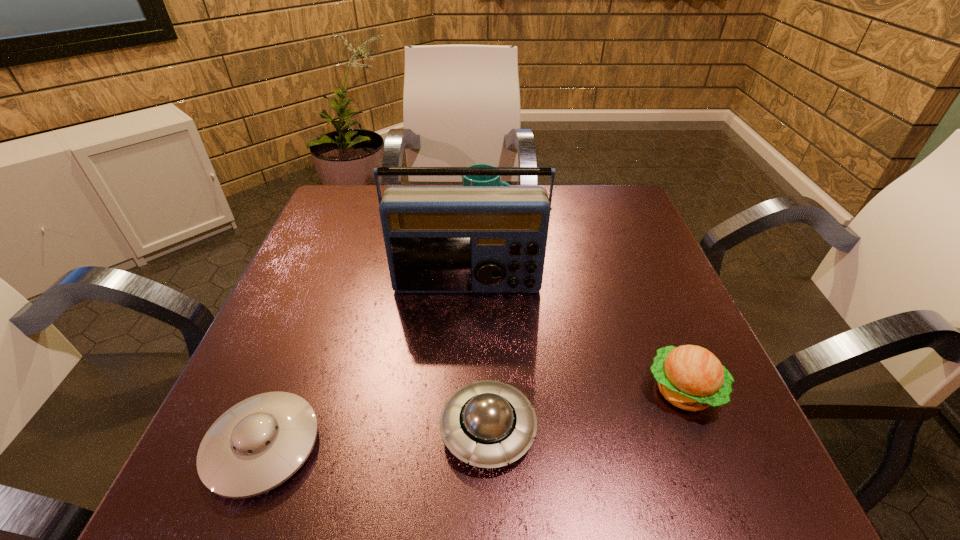
This screenshot has width=960, height=540. Find the location of `free space located on the front panel of the second farthest object`. free space located on the front panel of the second farthest object is located at coordinates (462, 448).

In order to click on vacant space situated on the handle side of the cup in this screenshot , I will do `click(542, 213)`.

Identify the location of vacant area situated 0.320m on the back of the third shortest object. This screenshot has height=540, width=960. (627, 252).

The width and height of the screenshot is (960, 540). I want to click on vacant position located 0.350m on the left of the right saucer, so click(x=214, y=429).

In order to click on blank space located on the back of the shorter saucer in this screenshot , I will do `click(299, 356)`.

Find the location of `object located in the far edge section of the desktop`. object located in the far edge section of the desktop is located at coordinates (466, 180).

Image resolution: width=960 pixels, height=540 pixels. Find the location of `object at the left edge`. object at the left edge is located at coordinates (259, 443).

This screenshot has width=960, height=540. Find the location of `object that is at the right edge`. object that is at the right edge is located at coordinates (690, 377).

This screenshot has height=540, width=960. Find the location of `object located in the near left corner section of the desktop`. object located in the near left corner section of the desktop is located at coordinates (259, 443).

In order to click on free space at the far edge of the desktop in this screenshot , I will do `click(567, 227)`.